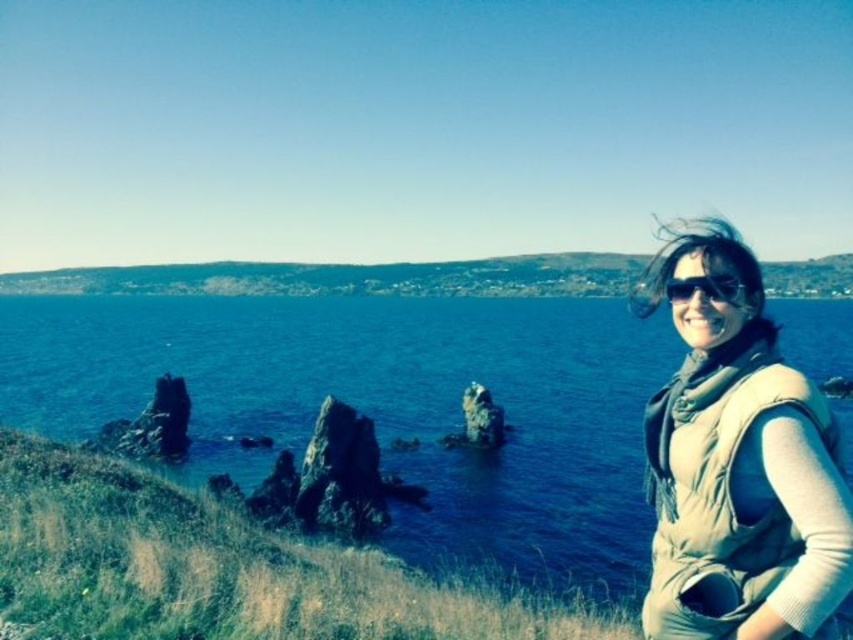
Who is more distant from viewer, (84,400) or (809,536)?

Positioned behind is point (84,400).

Can you confirm if blue water at center is positioned to the left of beige fabric scarf at right?

Indeed, blue water at center is positioned on the left side of beige fabric scarf at right.

What do you see at coordinates (383, 406) in the screenshot? I see `blue water at center` at bounding box center [383, 406].

Identify the location of blue water at center. (383, 406).

Can you confirm if beige fabric scarf at right is positioned below matte black goggles at right?

Yes.

I want to click on beige fabric scarf at right, so click(738, 467).

Based on the photo, can you confirm if green grassy hillside at upper center is positioned below matte black goggles at right?

No, green grassy hillside at upper center is not below matte black goggles at right.

Locate an element on the screen. The width and height of the screenshot is (853, 640). green grassy hillside at upper center is located at coordinates (349, 276).

Is point (299, 262) in front of point (741, 289)?

No, (299, 262) is behind (741, 289).

Find the location of `green grassy hillside at upper center`. green grassy hillside at upper center is located at coordinates point(349,276).